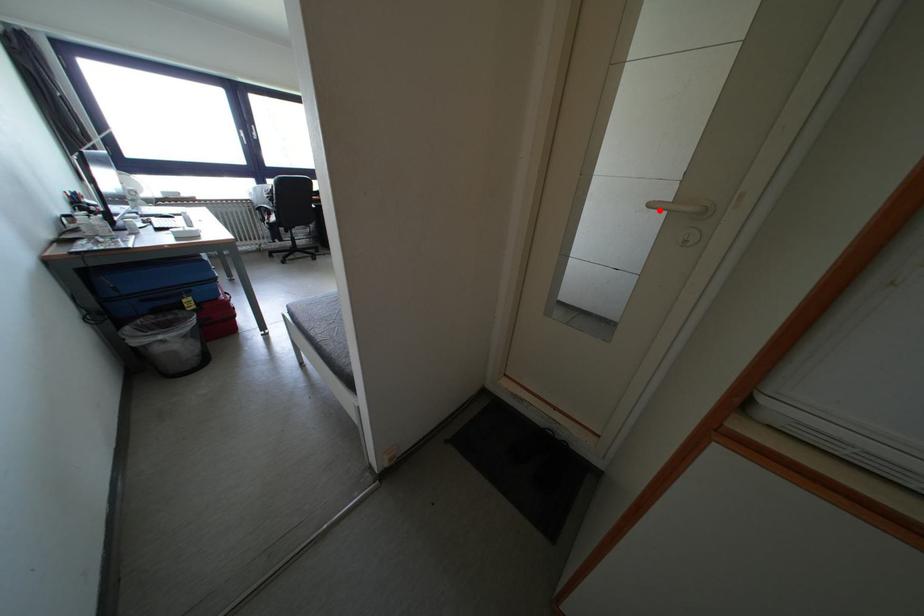
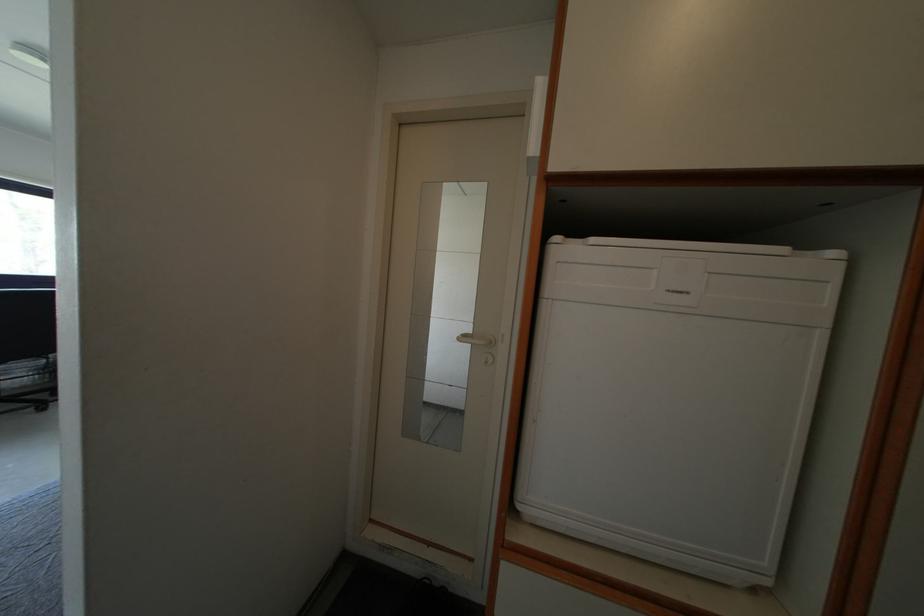
Where in the second image is the point corresponding to the highlighted location from the first image?

(468, 342)